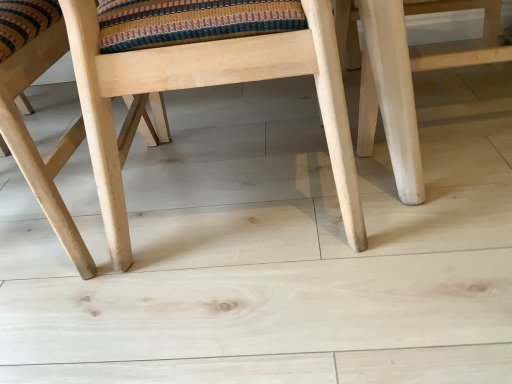
Question: Is natural wood chair at center, which is the 1th chair from right to left, further to the viewer compared to natural wood chair at center, the 2th chair viewed from the right?

Choices:
 (A) no
 (B) yes

Answer: (A)

Question: Is natural wood chair at center, the second chair from the left, outside natural wood chair at center, which ranks as the 1th chair in left-to-right order?

Choices:
 (A) no
 (B) yes

Answer: (B)

Question: Does natural wood chair at center, the second chair from the left, turn towards natural wood chair at center, the 2th chair viewed from the right?

Choices:
 (A) yes
 (B) no

Answer: (B)

Question: From the image's perspective, is natural wood chair at center, which is the 1th chair from right to left, over natural wood chair at center, the 2th chair viewed from the right?

Choices:
 (A) yes
 (B) no

Answer: (A)

Question: Can you confirm if natural wood chair at center, which is the 1th chair from right to left, is bigger than natural wood chair at center, which ranks as the 1th chair in left-to-right order?

Choices:
 (A) no
 (B) yes

Answer: (B)

Question: Does natural wood chair at center, the second chair from the left, have a smaller size compared to natural wood chair at center, the 2th chair viewed from the right?

Choices:
 (A) no
 (B) yes

Answer: (A)

Question: Is natural wood chair at center, the 2th chair viewed from the right, closer to camera compared to natural wood chair at center, which is the 1th chair from right to left?

Choices:
 (A) yes
 (B) no

Answer: (B)

Question: Is natural wood chair at center, the 2th chair viewed from the right, looking in the opposite direction of natural wood chair at center, which is the 1th chair from right to left?

Choices:
 (A) no
 (B) yes

Answer: (A)

Question: Is natural wood chair at center, which ranks as the 1th chair in left-to-right order, beside natural wood chair at center, the second chair from the left?

Choices:
 (A) no
 (B) yes

Answer: (A)

Question: Is natural wood chair at center, which ranks as the 1th chair in left-to-right order, wider than natural wood chair at center, which is the 1th chair from right to left?

Choices:
 (A) no
 (B) yes

Answer: (B)

Question: Is natural wood chair at center, the 2th chair viewed from the right, bigger than natural wood chair at center, which is the 1th chair from right to left?

Choices:
 (A) yes
 (B) no

Answer: (B)

Question: Is natural wood chair at center, which ranks as the 1th chair in left-to-right order, thinner than natural wood chair at center, which is the 1th chair from right to left?

Choices:
 (A) yes
 (B) no

Answer: (B)

Question: Is point (13, 76) positioned closer to the camera than point (90, 127)?

Choices:
 (A) farther
 (B) closer

Answer: (A)